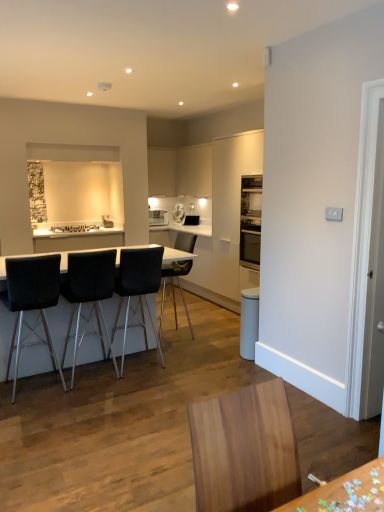
This screenshot has width=384, height=512. I want to click on free space in front of black leather chair at center, the third chair positioned from the left, so click(x=142, y=385).